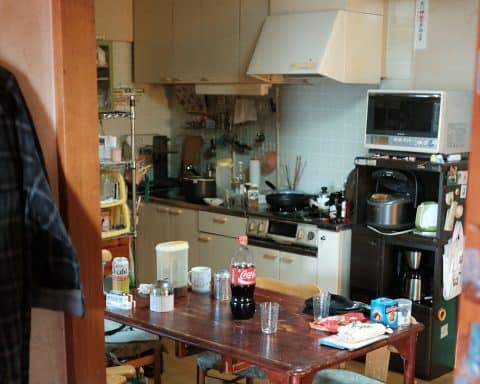
Locate an element on the screen. This screenshot has height=384, width=480. stove top is located at coordinates (296, 216).